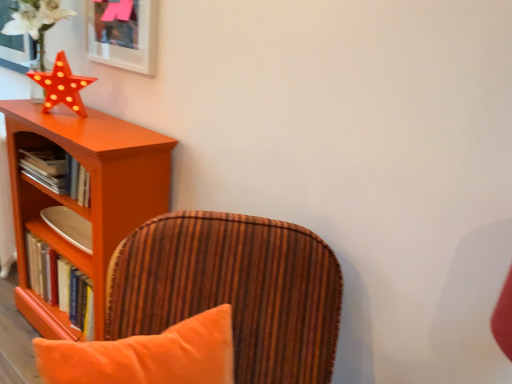
Question: Does matte orange star at upper left have a greater height compared to velvet orange chair at center?

Choices:
 (A) no
 (B) yes

Answer: (A)

Question: Is velvet orange chair at center a part of matte orange star at upper left?

Choices:
 (A) no
 (B) yes

Answer: (A)

Question: Can you confirm if matte orange star at upper left is wider than velvet orange chair at center?

Choices:
 (A) yes
 (B) no

Answer: (B)

Question: Does matte orange star at upper left have a lesser width compared to velvet orange chair at center?

Choices:
 (A) yes
 (B) no

Answer: (A)

Question: Is matte orange star at upper left further to the viewer compared to velvet orange chair at center?

Choices:
 (A) yes
 (B) no

Answer: (A)

Question: From the image's perspective, does matte orange star at upper left appear lower than velvet orange chair at center?

Choices:
 (A) no
 (B) yes

Answer: (A)

Question: Is matte orange star at upper left completely or partially outside of hardcover book at left, the 2th book in the top-to-bottom sequence?

Choices:
 (A) yes
 (B) no

Answer: (A)

Question: From a real-world perspective, is matte orange star at upper left under hardcover book at left, which ranks as the 1th book in bottom-to-top order?

Choices:
 (A) no
 (B) yes

Answer: (A)

Question: Is matte orange star at upper left far away from hardcover book at left, which ranks as the 1th book in bottom-to-top order?

Choices:
 (A) yes
 (B) no

Answer: (B)

Question: Is matte orange star at upper left closer to camera compared to hardcover book at left, the 2th book in the top-to-bottom sequence?

Choices:
 (A) yes
 (B) no

Answer: (A)

Question: Can you confirm if matte orange star at upper left is positioned to the right of hardcover book at left, which ranks as the 1th book in bottom-to-top order?

Choices:
 (A) yes
 (B) no

Answer: (A)

Question: Does matte orange star at upper left have a larger size compared to hardcover book at left, which ranks as the 1th book in bottom-to-top order?

Choices:
 (A) no
 (B) yes

Answer: (A)

Question: Can you confirm if orange wood shelf at left is positioned to the left of hardcover books at left, the first book when ordered from top to bottom?

Choices:
 (A) no
 (B) yes

Answer: (A)